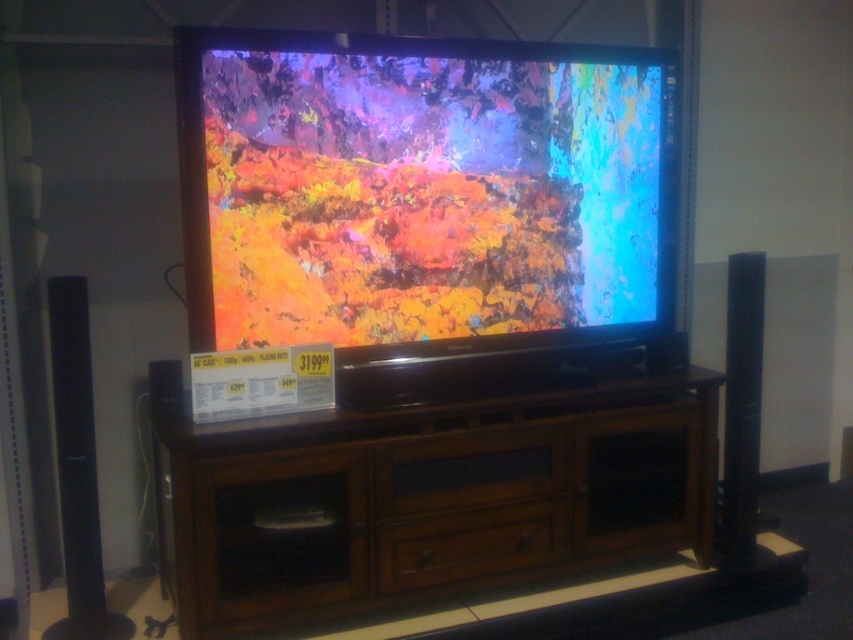
Locate an element on the screen. This screenshot has height=640, width=853. matte plastic television at center is located at coordinates (436, 192).

Where is `matte plastic television at center`? matte plastic television at center is located at coordinates (436, 192).

How far apart are brown wood entertainment center at center and black glossy speaker at right?

66.66 centimeters

Is the position of brown wood entertainment center at center more distant than that of black glossy speaker at right?

No, brown wood entertainment center at center is in front of black glossy speaker at right.

Is point (558, 445) farther from camera compared to point (728, 456)?

That is False.

Where is `brown wood entertainment center at center`? This screenshot has height=640, width=853. brown wood entertainment center at center is located at coordinates (434, 499).

Is brown wood entertainment center at center to the left of black glossy speaker at left from the viewer's perspective?

In fact, brown wood entertainment center at center is to the right of black glossy speaker at left.

Does brown wood entertainment center at center have a smaller size compared to black glossy speaker at left?

Incorrect, brown wood entertainment center at center is not smaller in size than black glossy speaker at left.

Does point (631, 448) come behind point (57, 314)?

Yes, point (631, 448) is behind point (57, 314).

Where is `brown wood entertainment center at center`? brown wood entertainment center at center is located at coordinates (434, 499).